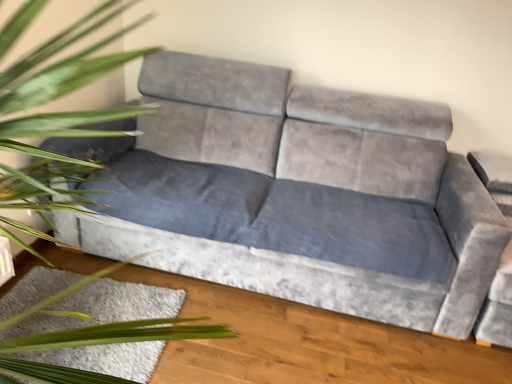
Measure the distance between green leafy plant at left and camera.

51.76 centimeters.

Describe the element at coordinates (53, 157) in the screenshot. Image resolution: width=512 pixels, height=384 pixels. I see `green leafy plant at left` at that location.

What do you see at coordinates (104, 307) in the screenshot? I see `white shaggy rug at lower left` at bounding box center [104, 307].

The width and height of the screenshot is (512, 384). In order to click on green leafy plant at left in this screenshot , I will do `click(53, 157)`.

How many degrees apart are the facing directions of velvet grey couch at center and white shaggy rug at lower left?

There is a 3.99-degree angle between the facing directions of velvet grey couch at center and white shaggy rug at lower left.

Is point (155, 148) positioned in front of point (87, 323)?

No, it is behind (87, 323).

Measure the distance between velvet grey couch at center and white shaggy rug at lower left.

velvet grey couch at center is 29.43 inches from white shaggy rug at lower left.

Is velvet grey couch at center turned away from white shaggy rug at lower left?

That's not correct — velvet grey couch at center is not looking away from white shaggy rug at lower left.

From the image's perspective, is velvet grey couch at center located above or below green leafy plant at left?

velvet grey couch at center is above green leafy plant at left.

Find the location of a particular element. The width and height of the screenshot is (512, 384). studio couch below the green leafy plant at left (from a real-world perspective) is located at coordinates (296, 194).

Is velvet grey couch at center oriented towards green leafy plant at left?

Yes, velvet grey couch at center faces towards green leafy plant at left.

From a real-world perspective, is velvet grey couch at center physically located above or below green leafy plant at left?

In terms of real-world spatial position, velvet grey couch at center is below green leafy plant at left.

Which is less distant, (20, 329) or (139, 327)?

Point (20, 329).

Which is behind, white shaggy rug at lower left or green leafy plant at left?

white shaggy rug at lower left is further away from the camera.

Which of these two, white shaggy rug at lower left or green leafy plant at left, is smaller?

white shaggy rug at lower left.

Is green leafy plant at left taller or shorter than white shaggy rug at lower left?

Considering their sizes, green leafy plant at left has more height than white shaggy rug at lower left.

Considering the positions of points (117, 335) and (39, 317), is point (117, 335) farther from camera compared to point (39, 317)?

No, it is in front of (39, 317).

Where is `mat on the left of green leafy plant at left`? This screenshot has height=384, width=512. mat on the left of green leafy plant at left is located at coordinates (104, 307).

From the image's perspective, who appears lower, green leafy plant at left or white shaggy rug at lower left?

From the image's view, white shaggy rug at lower left is below.

Is white shaggy rug at lower left spatially inside velvet grey couch at center, or outside of it?

white shaggy rug at lower left is outside velvet grey couch at center.

Is velvet grey couch at center at the back of white shaggy rug at lower left?

Correct, white shaggy rug at lower left is looking away from velvet grey couch at center.

Are white shaggy rug at lower left and velvet grey couch at center located far from each other?

No, white shaggy rug at lower left is not far away from velvet grey couch at center.

Which point is more forward, (130, 367) or (304, 262)?

Positioned in front is point (130, 367).

The width and height of the screenshot is (512, 384). I want to click on studio couch on the right of green leafy plant at left, so click(x=296, y=194).

Is green leafy plant at left positioned far away from velvet grey couch at center?

Yes, green leafy plant at left and velvet grey couch at center are located far from each other.

Is green leafy plant at left in front of or behind velvet grey couch at center in the image?

Visually, green leafy plant at left is located in front of velvet grey couch at center.

In the image, there is a velvet grey couch at center. At what (x,y) coordinates should I click in order to perform the action: click on mat below it (from the image's perspective). Please return your answer as a coordinate pair (x, y). The height and width of the screenshot is (384, 512). Looking at the image, I should click on (104, 307).

Locate an element on the screen. houseplant that is above the velvet grey couch at center (from a real-world perspective) is located at coordinates [53, 157].

When comparing their distances from green leafy plant at left, does white shaggy rug at lower left or velvet grey couch at center seem closer?

white shaggy rug at lower left lies closer to green leafy plant at left than the other object.

Considering their positions, is velvet grey couch at center positioned further to green leafy plant at left than white shaggy rug at lower left?

Based on the image, velvet grey couch at center appears to be further to green leafy plant at left.

When comparing their distances from velvet grey couch at center, does green leafy plant at left or white shaggy rug at lower left seem closer?

white shaggy rug at lower left is closer to velvet grey couch at center.

Looking at this image, from the image, which object appears to be nearer to white shaggy rug at lower left, green leafy plant at left or velvet grey couch at center?

Among the two, green leafy plant at left is located nearer to white shaggy rug at lower left.

Based on their spatial positions, is white shaggy rug at lower left or green leafy plant at left closer to velvet grey couch at center?

white shaggy rug at lower left is closer to velvet grey couch at center.

From the image, which object appears to be farther from white shaggy rug at lower left, velvet grey couch at center or green leafy plant at left?

velvet grey couch at center lies further to white shaggy rug at lower left than the other object.

You are a GUI agent. You are given a task and a screenshot of the screen. Output one action in this format:
    pyautogui.click(x=<x>, y=<y>)
    Task: Click on the studio couch between green leafy plant at left and white shaggy rug at lower left from front to back
    The height and width of the screenshot is (384, 512).
    Given the screenshot: What is the action you would take?
    pyautogui.click(x=296, y=194)